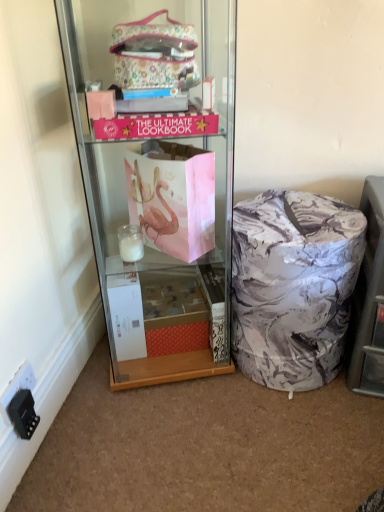
Question: Considering the positions of black plastic power outlet at lower left and marble-patterned ottoman at lower right in the image, is black plastic power outlet at lower left taller or shorter than marble-patterned ottoman at lower right?

Choices:
 (A) short
 (B) tall

Answer: (A)

Question: Is black plastic power outlet at lower left wider or thinner than marble-patterned ottoman at lower right?

Choices:
 (A) wide
 (B) thin

Answer: (B)

Question: Which object is the closest to the matte pink paper bag at center?

Choices:
 (A) marble-patterned laundry basket at lower right
 (B) black plastic power outlet at lower left
 (C) marble-patterned ottoman at lower right

Answer: (A)

Question: Which of these objects is positioned closest to the marble-patterned ottoman at lower right?

Choices:
 (A) matte pink paper bag at center
 (B) marble-patterned laundry basket at lower right
 (C) black plastic power outlet at lower left

Answer: (B)